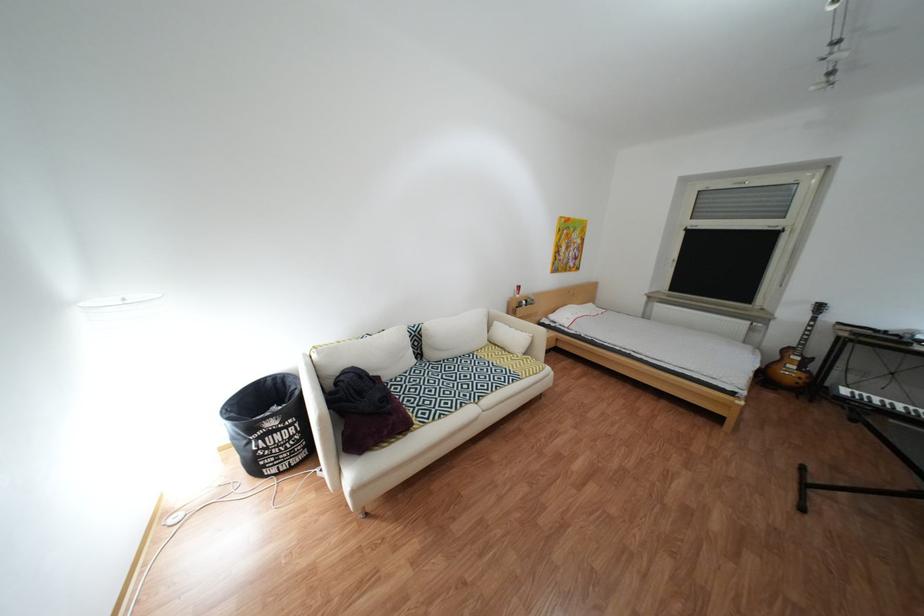
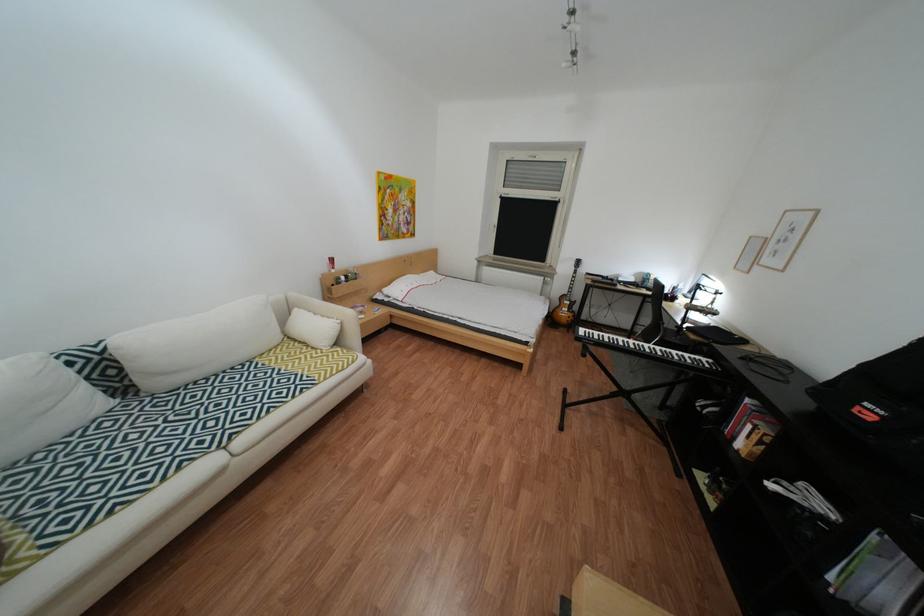
Find the pixel in the second image that matches (549,338) in the first image.

(358, 323)